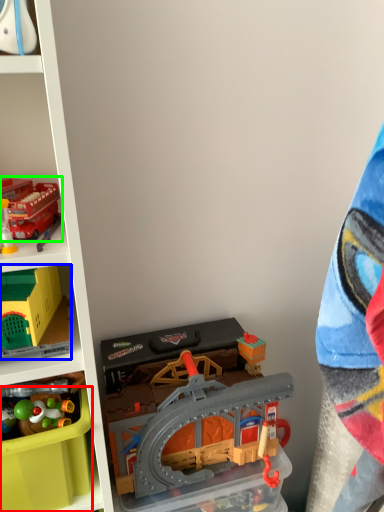
Question: Which is farther away from storage box (highlighted by a red box)? toy (highlighted by a blue box) or toy (highlighted by a green box)?

Choices:
 (A) toy
 (B) toy

Answer: (B)